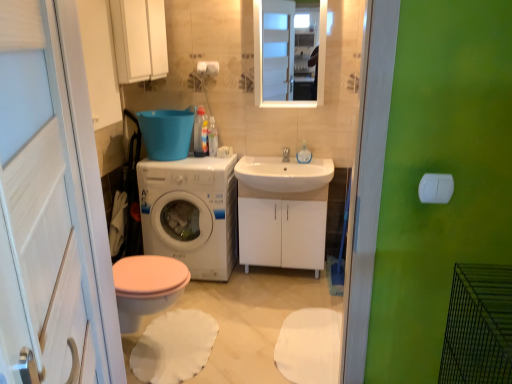
The image size is (512, 384). I want to click on free space above white glossy sink at center (from a real-world perspective), so click(x=274, y=167).